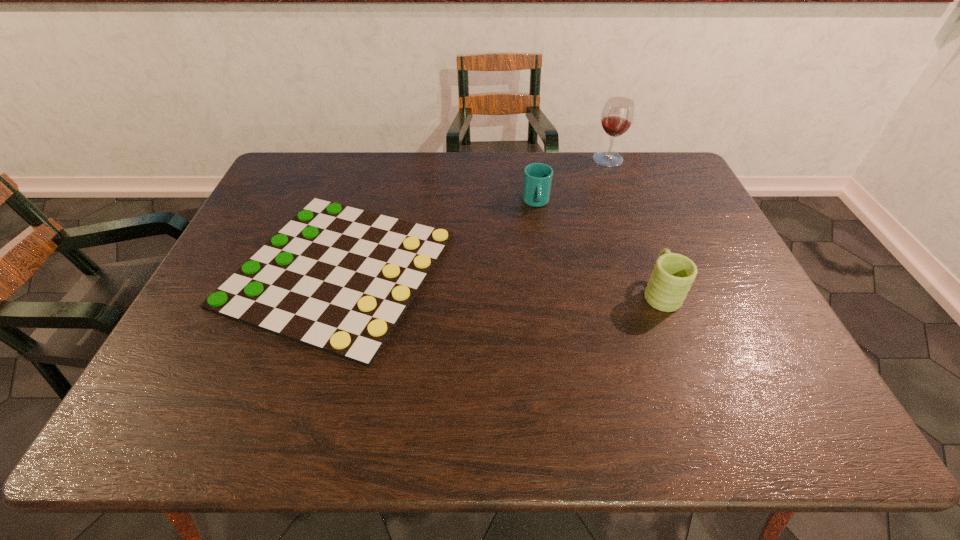
Where is `free space between the mug and the shortest object`? The width and height of the screenshot is (960, 540). free space between the mug and the shortest object is located at coordinates (499, 281).

You are a GUI agent. You are given a task and a screenshot of the screen. Output one action in this format:
    pyautogui.click(x=<x>, y=<y>)
    Task: Click on the empty location between the farthest object and the shortest object
    
    Given the screenshot: What is the action you would take?
    pyautogui.click(x=473, y=214)

The height and width of the screenshot is (540, 960). I want to click on vacant area that lies between the cup and the mug, so click(598, 247).

You are a GUI agent. You are given a task and a screenshot of the screen. Output one action in this format:
    pyautogui.click(x=<x>, y=<y>)
    Task: Click on the free space between the leftmost object and the mug
    The width and height of the screenshot is (960, 540).
    Given the screenshot: What is the action you would take?
    pyautogui.click(x=499, y=281)

The image size is (960, 540). Find the location of `free space between the cup and the mug`. free space between the cup and the mug is located at coordinates (598, 247).

At what (x,y) coordinates should I click in order to perform the action: click on free space between the checkerboard and the wineglass. Please return your answer as a coordinate pair (x, y). The height and width of the screenshot is (540, 960). Looking at the image, I should click on (473, 214).

Image resolution: width=960 pixels, height=540 pixels. I want to click on object that is the third closest to the tallest object, so click(x=338, y=279).

This screenshot has width=960, height=540. I want to click on the third closest object to the mug, so click(x=617, y=116).